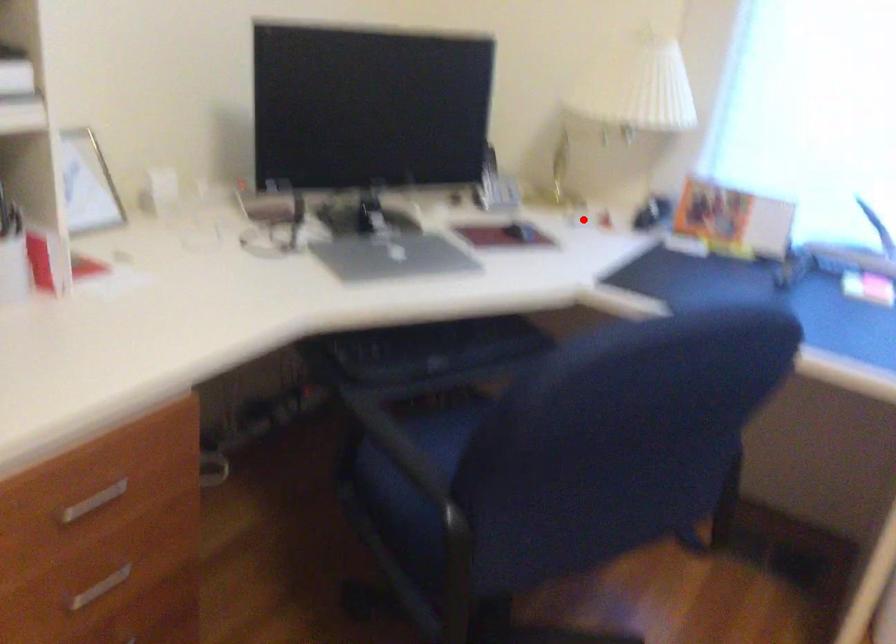
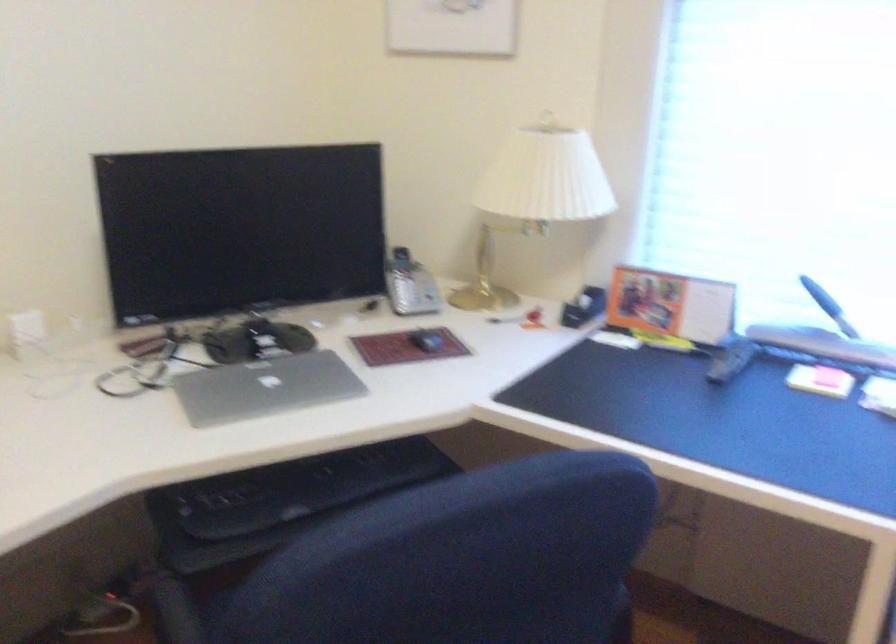
Where in the second image is the point corresponding to the highlighted location from the first image?

(504, 319)